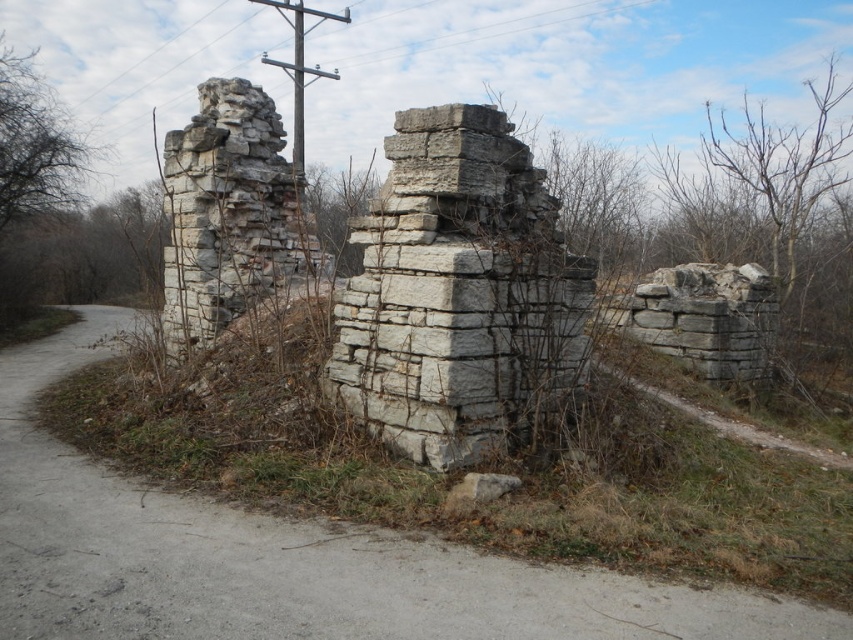
Question: Which point is closer to the camera?

Choices:
 (A) (544, 339)
 (B) (270, 198)
 (C) (241, 561)
 (D) (294, 44)

Answer: (C)

Question: Can you confirm if gray stone wall at center is bigger than gray stone ruins at center?

Choices:
 (A) yes
 (B) no

Answer: (A)

Question: Estimate the real-world distances between objects in this image. Which object is closer to the white stone ruins at left?

Choices:
 (A) gray stone ruins at center
 (B) gray stone wall at center
 (C) gray stone telegraph pole at upper center

Answer: (C)

Question: Which object is the farthest from the gray stone wall at center?

Choices:
 (A) white stone ruins at left
 (B) gray stone telegraph pole at upper center
 (C) gray stone ruins at center

Answer: (B)

Question: Does gray stone ruins at center appear on the right side of gray stone telegraph pole at upper center?

Choices:
 (A) yes
 (B) no

Answer: (A)

Question: Does gray stone wall at center have a larger size compared to gray stone telegraph pole at upper center?

Choices:
 (A) no
 (B) yes

Answer: (A)